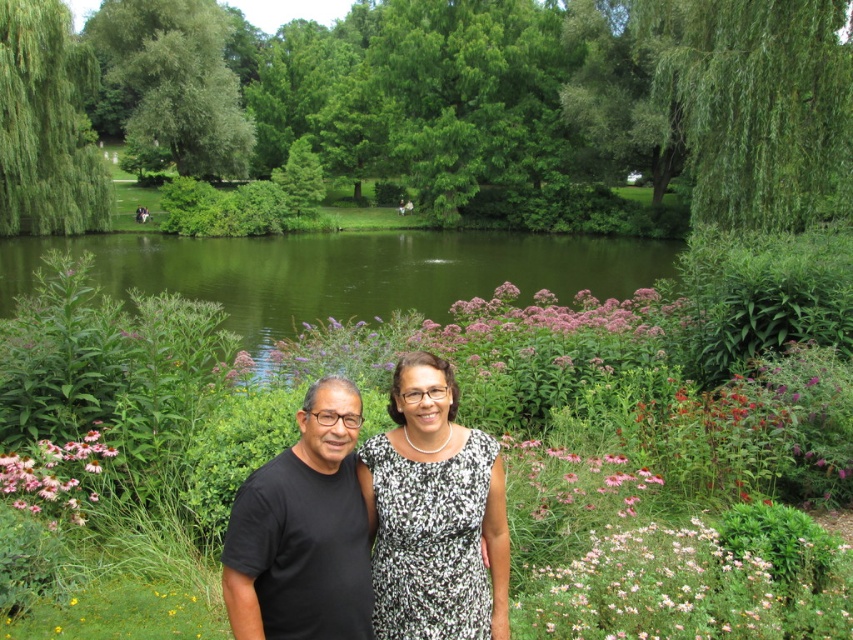
You are a photographer wanting to capture a shot of the green smooth water at center and the pink matte flower at center. Which object should you focus on first if you want to ensure both are in the frame without moving the camera?

The green smooth water at center is located above the pink matte flower at center, so you should focus on the pink matte flower at center first to ensure both are in the frame without moving the camera.